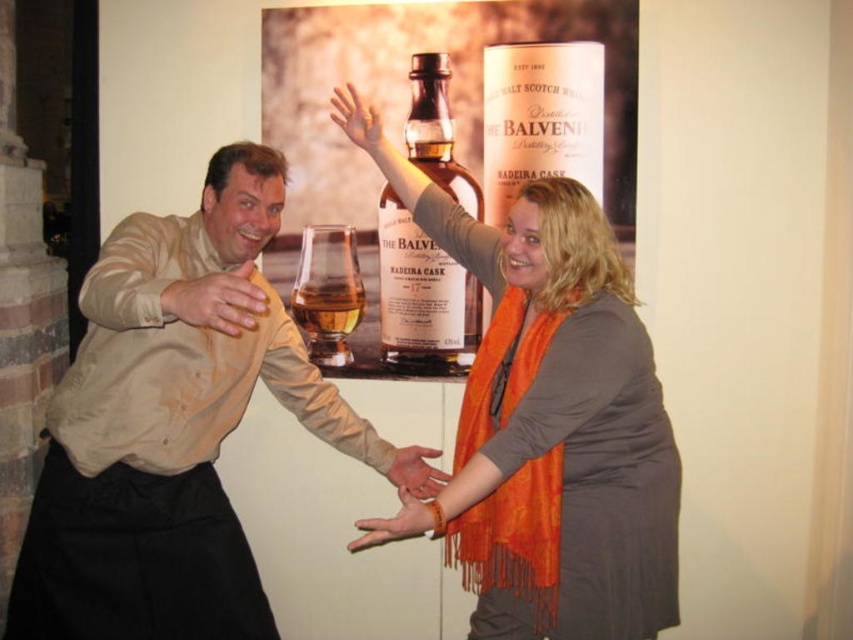
Who is positioned more to the right, matte beige shirt at center or smooth skin hand at lower center?

smooth skin hand at lower center

Can you confirm if matte beige shirt at center is taller than smooth skin hand at lower center?

Yes, matte beige shirt at center is taller than smooth skin hand at lower center.

This screenshot has height=640, width=853. I want to click on matte beige shirt at center, so click(167, 432).

Between matte beige shirt at center and matte orange scarf at lower center, which one appears on the left side from the viewer's perspective?

matte beige shirt at center is more to the left.

Which is in front, point (171, 442) or point (431, 490)?

Positioned in front is point (171, 442).

Identify the location of matte beige shirt at center. This screenshot has width=853, height=640. (167, 432).

Is matte gray sweater at center to the right of matte glass bottle at center from the viewer's perspective?

Yes, matte gray sweater at center is to the right of matte glass bottle at center.

Does point (480, 625) come in front of point (379, 280)?

Yes, point (480, 625) is closer to viewer.

What are the coordinates of `matte gray sweater at center` in the screenshot? It's located at (555, 426).

Identify the location of matte gray sweater at center. This screenshot has width=853, height=640. (555, 426).